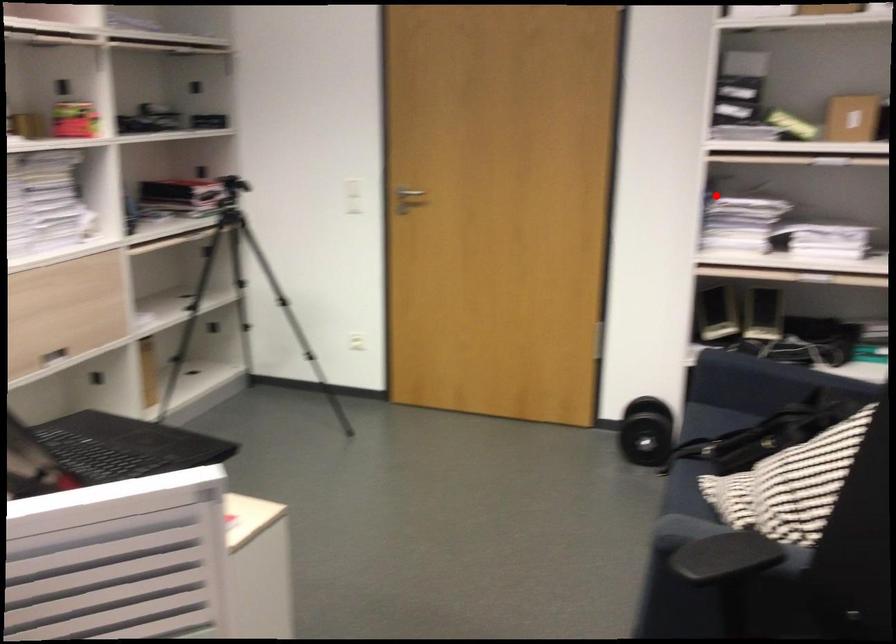
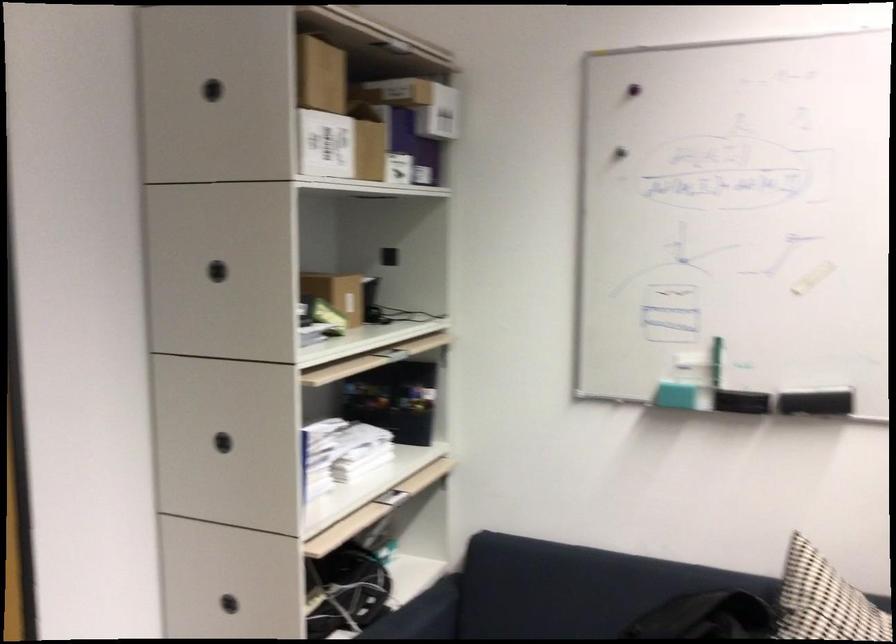
The point at the highlighted location is marked in the first image. Where is the corresponding point in the second image?

(222, 442)